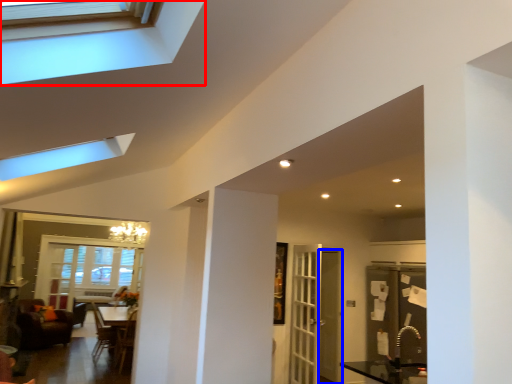
Question: Which object appears farthest to the camera in this image, window (highlighted by a red box) or screen door (highlighted by a blue box)?

Choices:
 (A) window
 (B) screen door

Answer: (B)